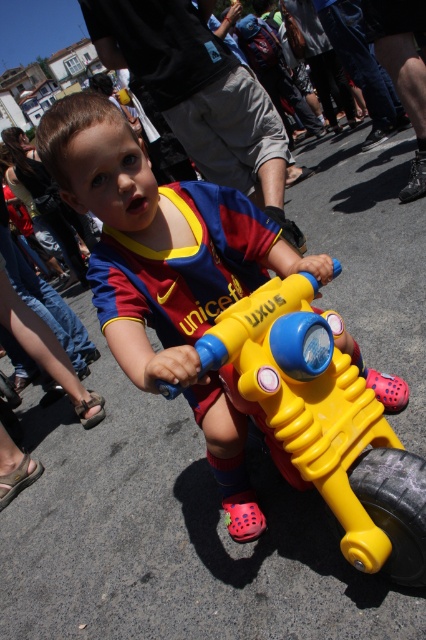
Is yellow plastic toy car at center taller than black rubber tire at lower right?

Indeed, yellow plastic toy car at center has a greater height compared to black rubber tire at lower right.

This screenshot has width=426, height=640. What do you see at coordinates (325, 422) in the screenshot?
I see `yellow plastic toy car at center` at bounding box center [325, 422].

I want to click on yellow plastic toy car at center, so click(325, 422).

Can you confirm if yellow plastic toy at center is positioned below black rubber tire at lower right?

No.

Who is more distant from viewer, (147, 305) or (333, 528)?

Point (147, 305)

Is point (199, 317) less distant than point (416, 564)?

No, it is behind (416, 564).

The image size is (426, 640). Identify the location of yellow plastic toy at center. click(172, 276).

Is point (108, 109) positioned in front of point (382, 552)?

No, (108, 109) is further to viewer.

Find the location of a particular element. yellow plastic toy at center is located at coordinates (172, 276).

Where is `yellow plastic toy at center`? This screenshot has height=640, width=426. yellow plastic toy at center is located at coordinates (172, 276).